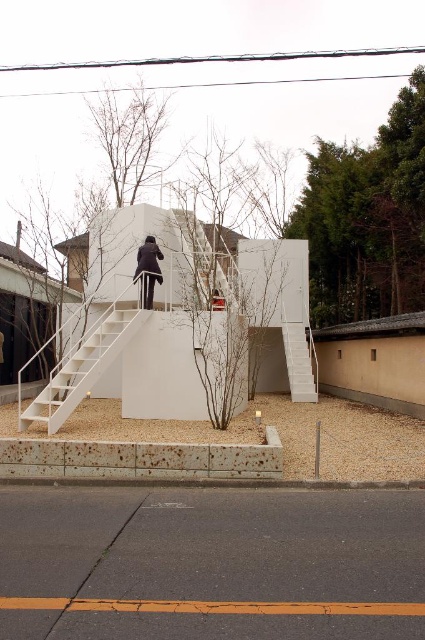
Question: Does white matte staircase at center have a smaller size compared to white matte stair at center?

Choices:
 (A) yes
 (B) no

Answer: (B)

Question: Which object is the closest to the black matte jacket at center?

Choices:
 (A) white matte stair at center
 (B) white matte staircase at center

Answer: (B)

Question: Which of the following is the closest to the observer?

Choices:
 (A) white matte stair at center
 (B) black matte jacket at center

Answer: (B)

Question: Based on their relative distances, which object is farther from the black matte jacket at center?

Choices:
 (A) white matte staircase at center
 (B) white matte stair at center

Answer: (B)

Question: From the image, what is the correct spatial relationship of white matte staircase at center in relation to white matte stair at center?

Choices:
 (A) below
 (B) above

Answer: (A)

Question: Is white matte stair at center wider than black matte jacket at center?

Choices:
 (A) no
 (B) yes

Answer: (B)